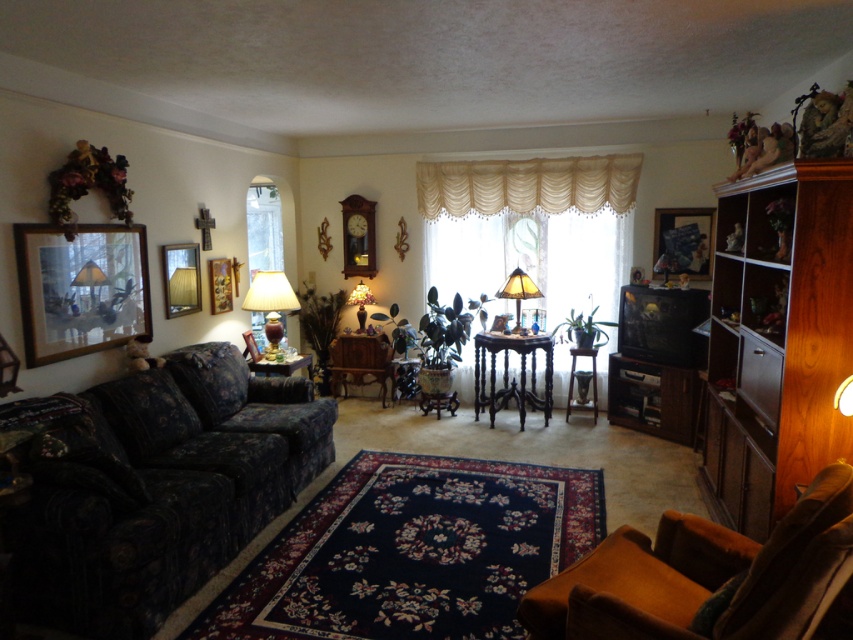
You are an interior designer planning to install a new light fixture between the ivory satin valance at center and the wooden picture frame at upper right. The fixture requires a minimum of 30 inches of space between the two objects. Based on the current spacing, will the fixture fit?

The ivory satin valance at center and wooden picture frame at upper right are 28.99 inches apart, which is less than the required 30 inches. Therefore, the light fixture will not fit between them.